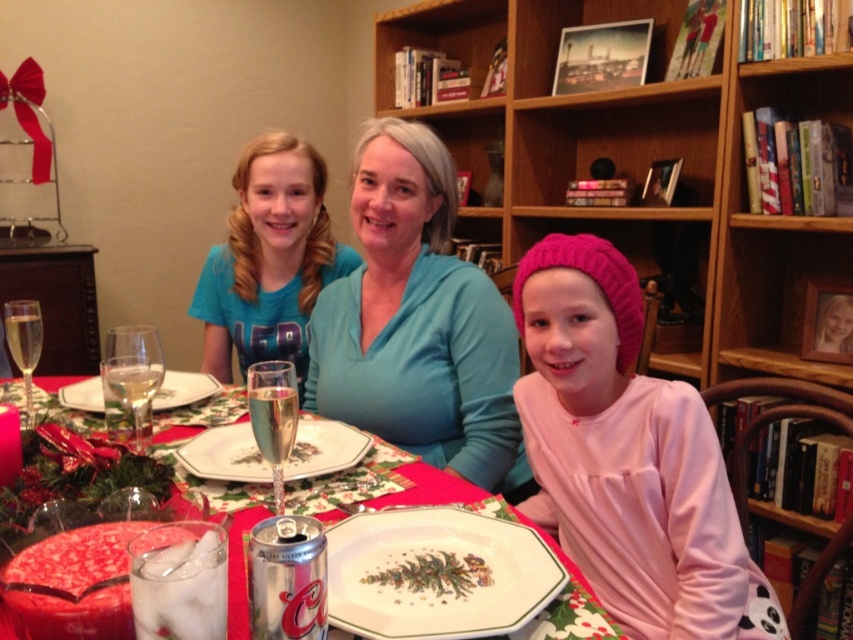
Question: In this image, where is metallic silver can at center located relative to clear glass wine glass at left?

Choices:
 (A) above
 (B) below

Answer: (B)

Question: Among these objects, which one is farthest from the camera?

Choices:
 (A) clear glass wine glass at left
 (B) porcelain plate at center
 (C) wooden bookshelf at upper center
 (D) white ceramic platter at center

Answer: (C)

Question: Which point is closer to the camera taking this photo?

Choices:
 (A) (312, 470)
 (B) (38, 336)
 (C) (283, 506)
 (D) (424, 381)

Answer: (C)

Question: Is porcelain plate with christmas tree design at center bigger than white ceramic platter at center?

Choices:
 (A) yes
 (B) no

Answer: (B)

Question: Does pink knit hat at right appear over clear glass wine glass at left?

Choices:
 (A) yes
 (B) no

Answer: (B)

Question: Which of the following is the farthest from the observer?

Choices:
 (A) (619, 172)
 (B) (107, 376)

Answer: (A)